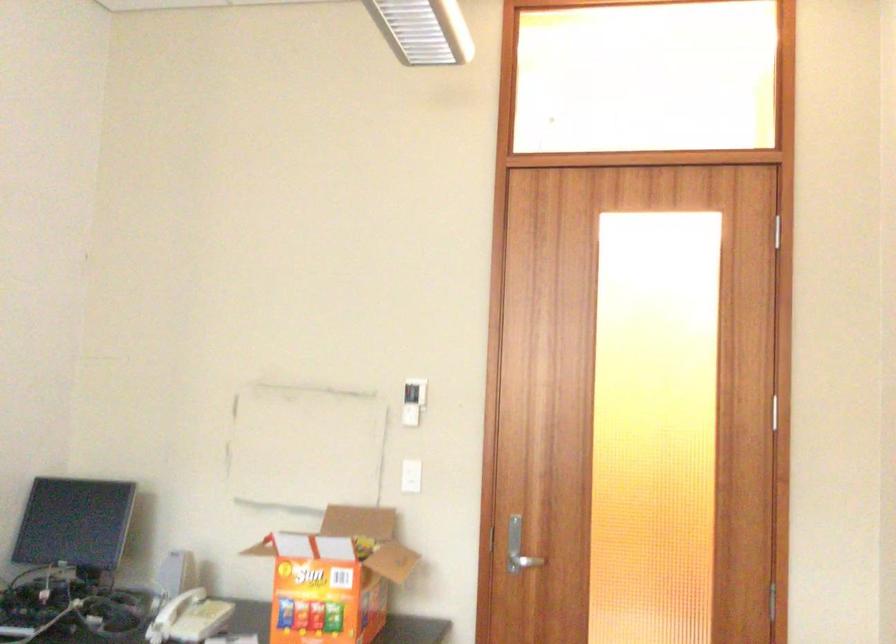
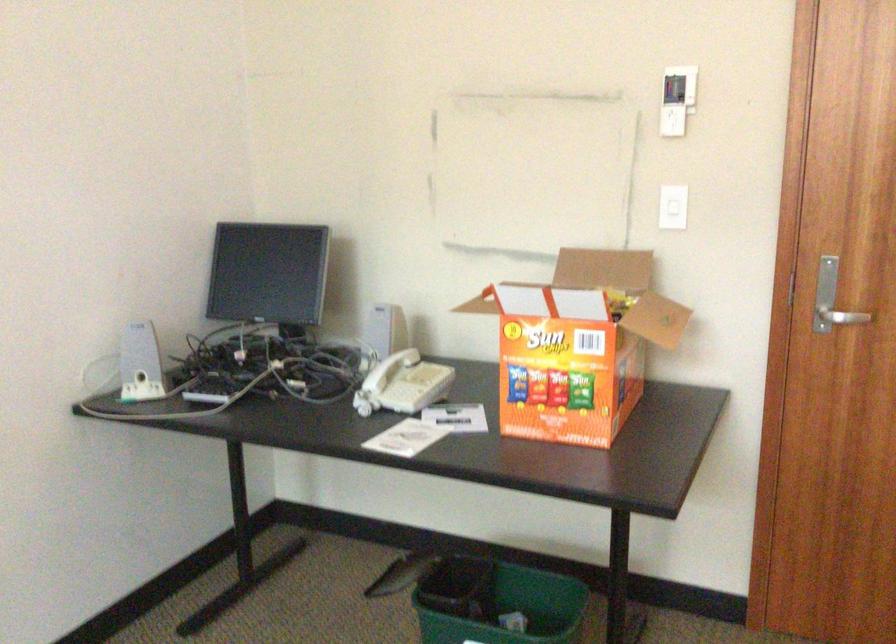
Locate, in the second image, the point that corresponds to (x=175, y=567) in the first image.

(384, 328)